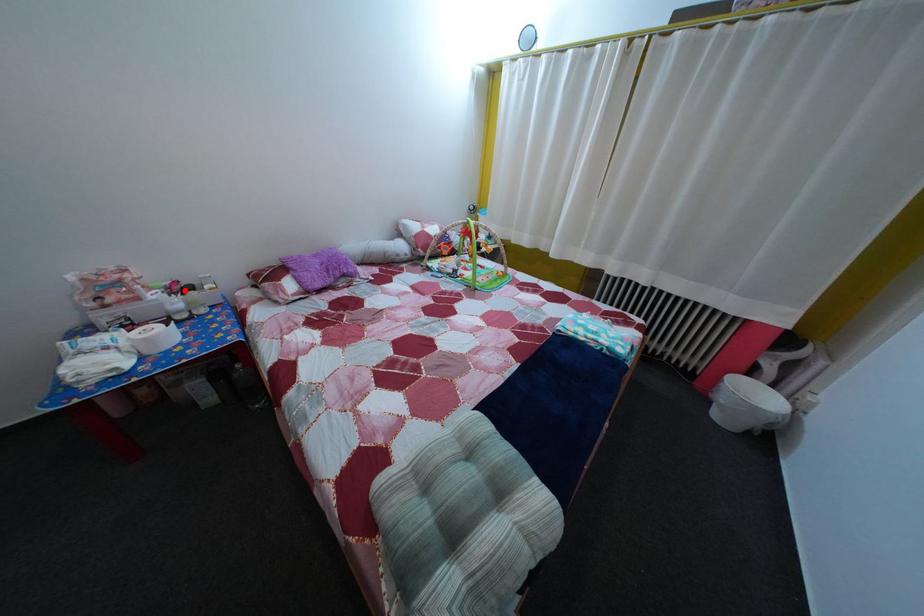
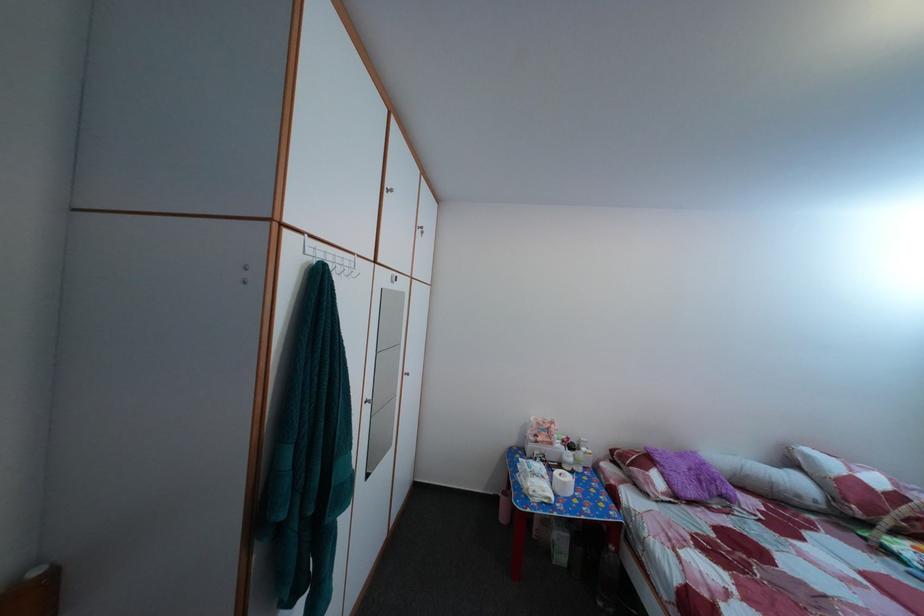
Question: I am providing you with two images of the same scene from different viewpoints. A red point is shown in image1. For the corresponding object point in image2, is it positioned nearer or farther from the camera?

Choices:
 (A) Nearer
 (B) Farther

Answer: (B)